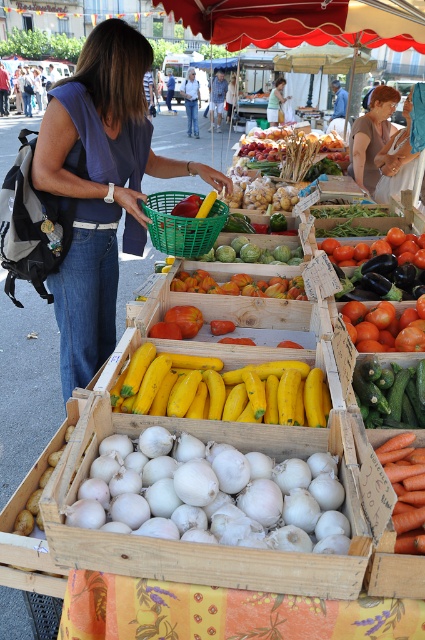
Question: Based on their relative distances, which object is farther from the smooth orange tomatoes at center?

Choices:
 (A) short curly hair at upper right
 (B) green woven basket at center

Answer: (A)

Question: Is white smooth onions at center thinner than smooth orange tomatoes at center?

Choices:
 (A) yes
 (B) no

Answer: (B)

Question: Which of the following is the farthest from the observer?

Choices:
 (A) green matte cucumber at center
 (B) short curly hair at upper right
 (C) yellow matte zucchini at center

Answer: (B)

Question: Is green woven basket at center positioned at the back of smooth orange tomatoes at center?

Choices:
 (A) no
 (B) yes

Answer: (A)

Question: Is orange smooth carrot at lower right thinner than smooth skin woman at center?

Choices:
 (A) no
 (B) yes

Answer: (B)

Question: Which point is closer to the camera?

Choices:
 (A) short curly hair at upper right
 (B) green matte cucumber at center

Answer: (B)